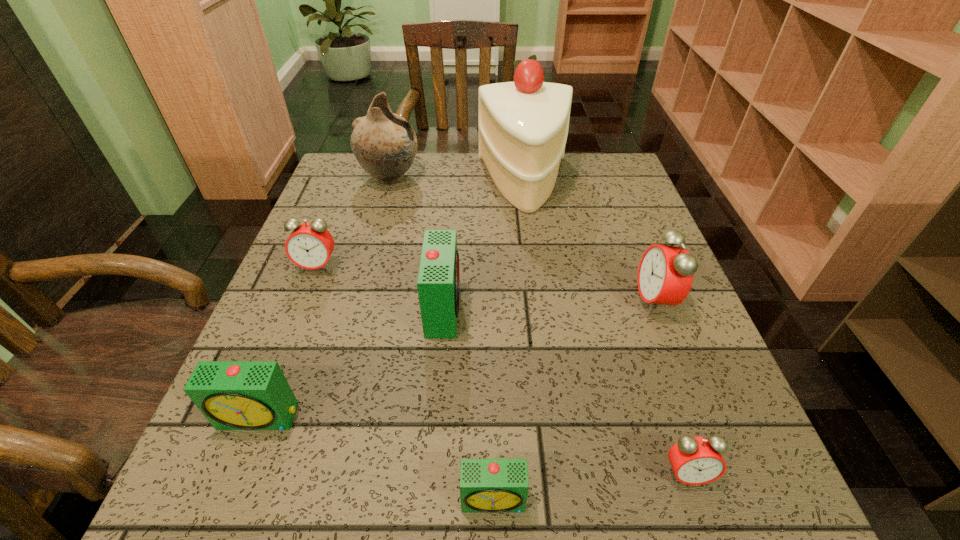
This screenshot has width=960, height=540. I want to click on the tallest object, so click(523, 125).

Locate an element on the screen. This screenshot has height=540, width=960. pottery is located at coordinates (385, 145).

Identify the location of the biggest red alarm clock. The width and height of the screenshot is (960, 540). (665, 274).

The width and height of the screenshot is (960, 540). What are the coordinates of `the biggest green alarm clock` in the screenshot? It's located at (438, 283).

Identify the location of the second green alarm clock from left to right. (438, 283).

Identify the location of the sixth nearest object. (310, 245).

Where is `the farthest red alarm clock`? the farthest red alarm clock is located at coordinates (310, 245).

Find the location of a particular element. This screenshot has width=960, height=540. the sixth farthest object is located at coordinates (233, 395).

The image size is (960, 540). I want to click on the second biggest green alarm clock, so click(x=233, y=395).

You are a GUI agent. You are given a task and a screenshot of the screen. Output one action in this format:
    pyautogui.click(x=<x>, y=<y>)
    Task: Click on the nearest red alarm clock
    The height and width of the screenshot is (540, 960).
    Given the screenshot: What is the action you would take?
    pyautogui.click(x=695, y=460)